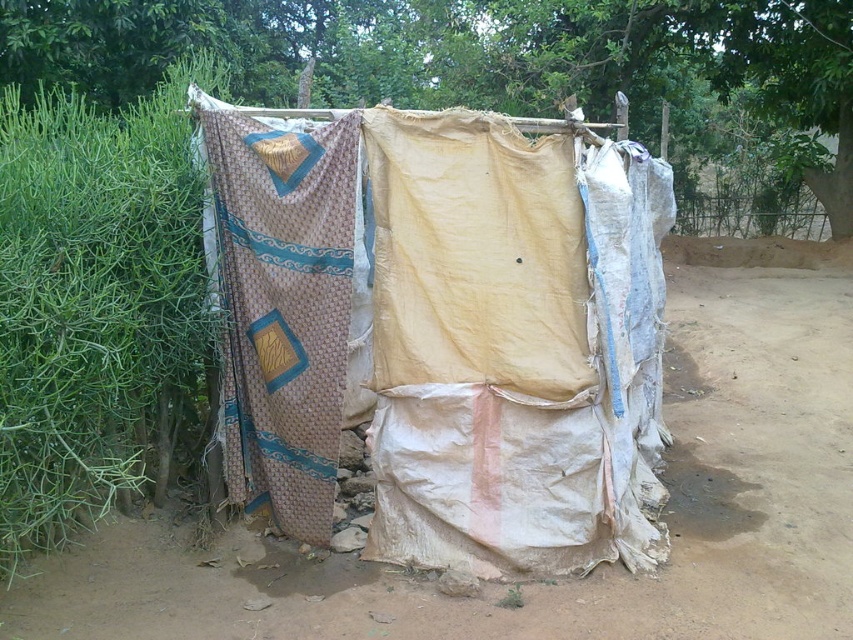
Question: Which object is the closest to the printed fabric cloth at center?

Choices:
 (A) beige woven cloth at left
 (B) brown dirt field at center

Answer: (A)

Question: Is printed fabric cloth at center to the left of beige woven cloth at left from the viewer's perspective?

Choices:
 (A) yes
 (B) no

Answer: (B)

Question: Is printed fabric cloth at center wider than beige woven cloth at left?

Choices:
 (A) yes
 (B) no

Answer: (A)

Question: Which object is farther from the camera taking this photo?

Choices:
 (A) beige woven cloth at left
 (B) printed fabric cloth at center

Answer: (A)

Question: Which point is farther to the camera?

Choices:
 (A) [x=451, y=448]
 (B) [x=283, y=260]
 (C) [x=828, y=262]

Answer: (C)

Question: Can you confirm if brown dirt field at center is positioned above beige woven cloth at left?

Choices:
 (A) no
 (B) yes

Answer: (A)